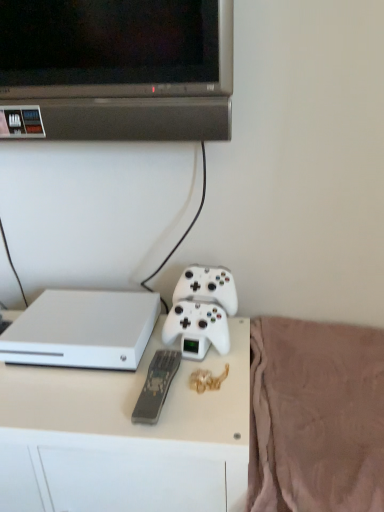
This screenshot has height=512, width=384. What are the coordinates of `vacant space situated above white matte gaming console at lower left (from a real-world perspective)` in the screenshot? It's located at (79, 314).